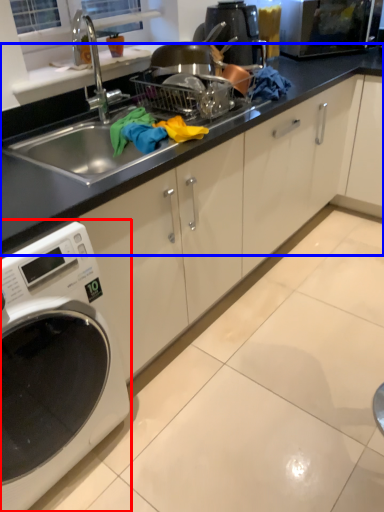
Question: Which object appears farthest to the camera in this image, home appliance (highlighted by a red box) or countertop (highlighted by a blue box)?

Choices:
 (A) home appliance
 (B) countertop

Answer: (B)